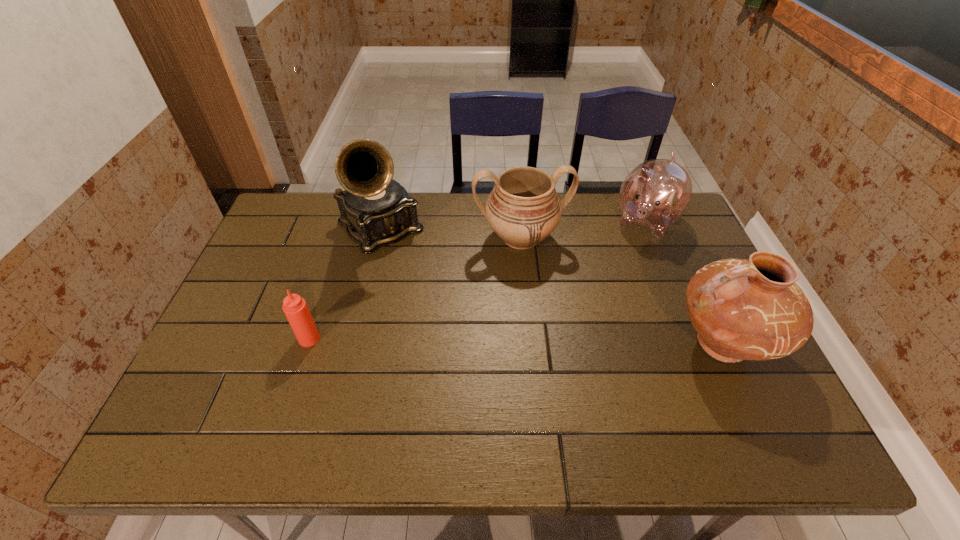
Where is `the shortest object`? Image resolution: width=960 pixels, height=540 pixels. the shortest object is located at coordinates (295, 307).

This screenshot has width=960, height=540. I want to click on pottery, so click(742, 309).

The image size is (960, 540). What are the coordinates of `urn` in the screenshot? It's located at (523, 209).

At what (x,y) coordinates should I click in order to perform the action: click on piggy bank. Please return your answer as a coordinate pair (x, y). Looking at the image, I should click on 655,194.

Find the location of `the tallest object`. the tallest object is located at coordinates (376, 210).

Where is `vacant region located on the left of the shortest object`? vacant region located on the left of the shortest object is located at coordinates (243, 339).

You are a GUI agent. You are given a task and a screenshot of the screen. Output one action in this format:
    pyautogui.click(x=<x>, y=<y>)
    Task: Click on the free region located 0.210m on the side of the pottery with the handle
    
    Given the screenshot: What is the action you would take?
    pyautogui.click(x=586, y=344)

At what (x,y) coordinates should I click in order to perform the action: click on blank space located 0.400m on the side of the pottery with the handle. Please return your answer as a coordinate pair (x, y). Looking at the image, I should click on (510, 344).

Find the location of a particular element. vacant area situated on the side of the pottery with the handle is located at coordinates (582, 344).

Locate an element on the screen. The width and height of the screenshot is (960, 540). free space located 0.370m on the front-facing side of the third object from left to right is located at coordinates (557, 370).